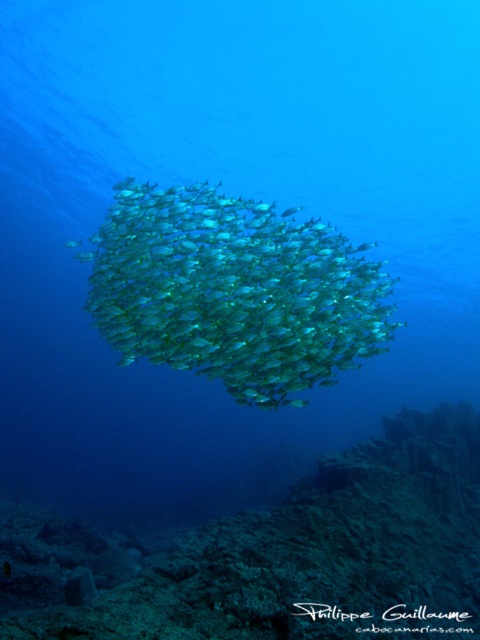
Question: Can you confirm if rugged stone coral reef at center is positioned above translucent greenish-blue fish at center?

Choices:
 (A) no
 (B) yes

Answer: (A)

Question: Which point is closer to the camera taking this photo?

Choices:
 (A) (264, 630)
 (B) (184, 186)

Answer: (A)

Question: Does rugged stone coral reef at center appear over translucent greenish-blue fish at center?

Choices:
 (A) yes
 (B) no

Answer: (B)

Question: Which of the following is the farthest from the observer?

Choices:
 (A) (358, 260)
 (B) (431, 448)

Answer: (B)

Question: Is rugged stone coral reef at center wider than translucent greenish-blue fish at center?

Choices:
 (A) yes
 (B) no

Answer: (B)